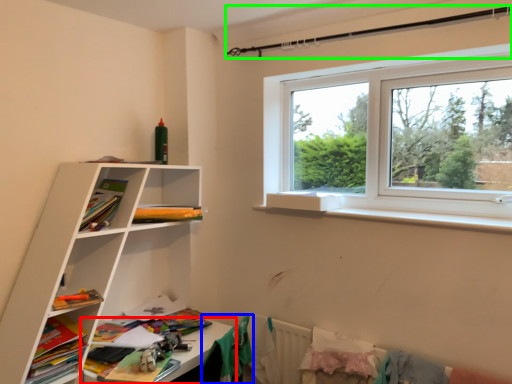
Question: Considering the real-world distances, which object is farthest from table (highlighted by a red box)? clothing (highlighted by a blue box) or clothesline (highlighted by a green box)?

Choices:
 (A) clothing
 (B) clothesline

Answer: (B)